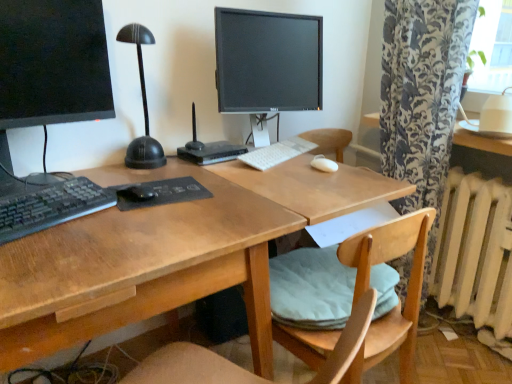
Question: From a real-world perspective, is light wood chair at center positioned above or below black plastic router at center?

Choices:
 (A) below
 (B) above

Answer: (A)

Question: Is point (325, 379) positioned closer to the camera than point (216, 152)?

Choices:
 (A) farther
 (B) closer

Answer: (B)

Question: Which object is the farthest from the light wood chair at center?

Choices:
 (A) translucent plastic keyboard at left
 (B) wooden desk at center
 (C) black plastic router at center
 (D) white painted metal radiator at lower right
 (E) matte black monitor at center, placed as the second computer monitor when sorted from left to right

Answer: (E)

Question: Which is nearer to the matte black monitor at left, which is counted as the first computer monitor, starting from the front?

Choices:
 (A) matte black monitor at center, which appears as the 1th computer monitor when viewed from the right
 (B) white matte mouse at center
 (C) white plastic keyboard at center
 (D) translucent plastic keyboard at left
 (E) light wood chair at center

Answer: (D)